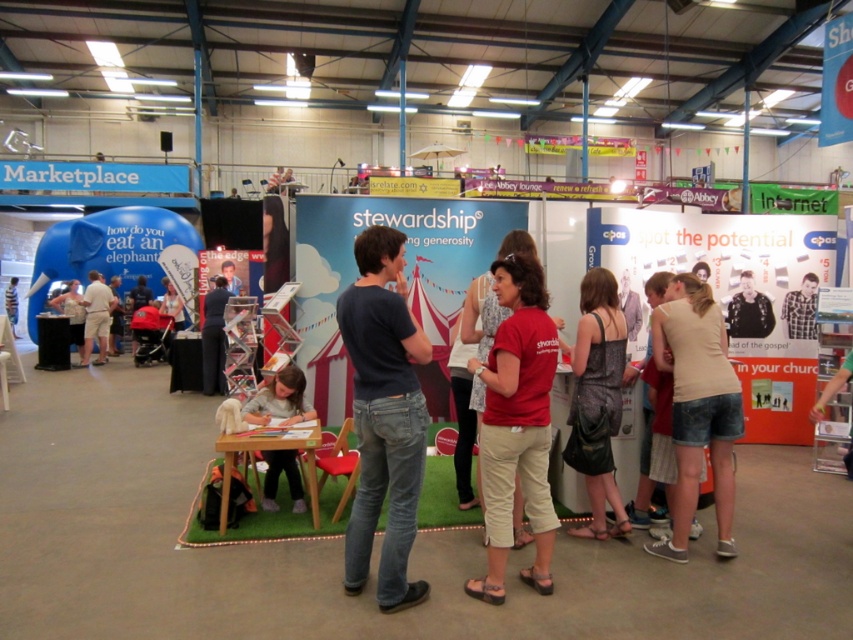
Is black leather jacket at center further to camera compared to striped t-shirt at center?

No, it is in front of striped t-shirt at center.

Can you confirm if black leather jacket at center is wider than striped t-shirt at center?

No, black leather jacket at center is not wider than striped t-shirt at center.

I want to click on black leather jacket at center, so click(747, 310).

The image size is (853, 640). What are the coordinates of `black leather jacket at center` in the screenshot? It's located at (747, 310).

Is dark blue shirt at center shorter than plaid shirt at center?

In fact, dark blue shirt at center may be taller than plaid shirt at center.

Can you confirm if dark blue shirt at center is taller than plaid shirt at center?

Indeed, dark blue shirt at center has a greater height compared to plaid shirt at center.

Which is in front, point (209, 314) or point (781, 308)?

Point (781, 308) is in front.

In order to click on dark blue shirt at center in this screenshot , I will do `click(213, 339)`.

Which is below, red matte shirt at center or black leather jacket at center?

red matte shirt at center is below.

Which is more to the left, red matte shirt at center or black leather jacket at center?

red matte shirt at center

Measure the distance between red matte shirt at center and camera.

red matte shirt at center and camera are 2.91 meters apart.

At what (x,y) coordinates should I click in order to perform the action: click on red matte shirt at center. Please return your answer as a coordinate pair (x, y). The width and height of the screenshot is (853, 640). Looking at the image, I should click on (517, 422).